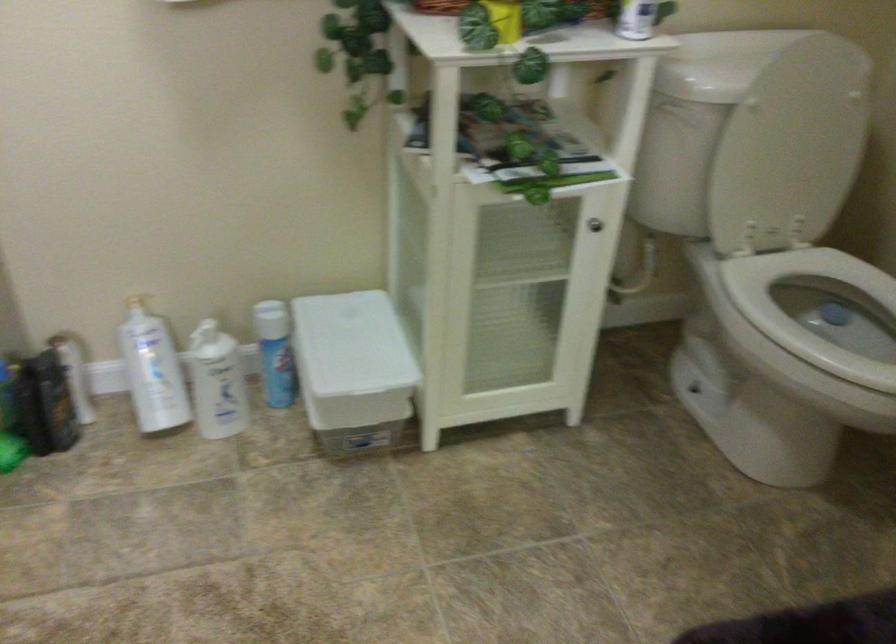
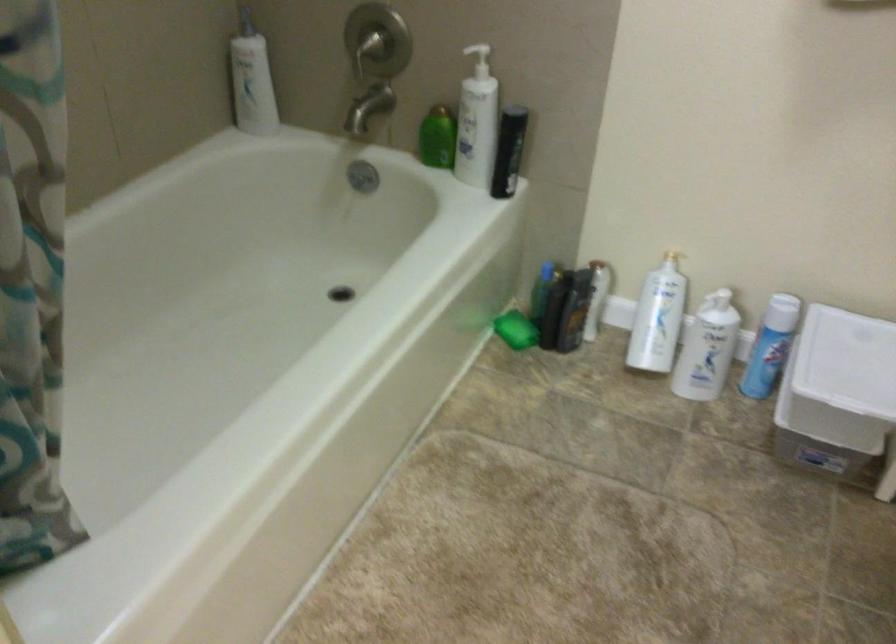
The point at (349, 346) is marked in the first image. Where is the corresponding point in the second image?

(847, 361)